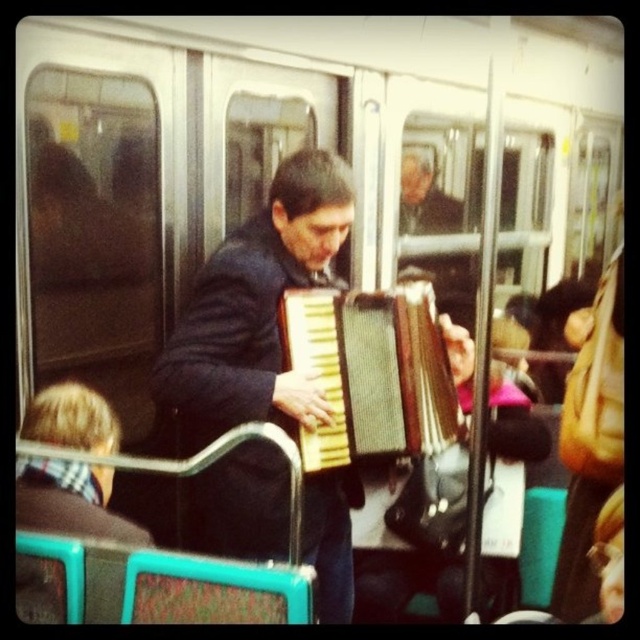
How distant is dark blue fabric accordion at center from wooden accordion at center?

The distance of dark blue fabric accordion at center from wooden accordion at center is 8.53 inches.

Does dark blue fabric accordion at center appear over wooden accordion at center?

No.

Identify the location of dark blue fabric accordion at center. This screenshot has width=640, height=640. (257, 307).

Where is `dark blue fabric accordion at center`? The image size is (640, 640). dark blue fabric accordion at center is located at coordinates (257, 307).